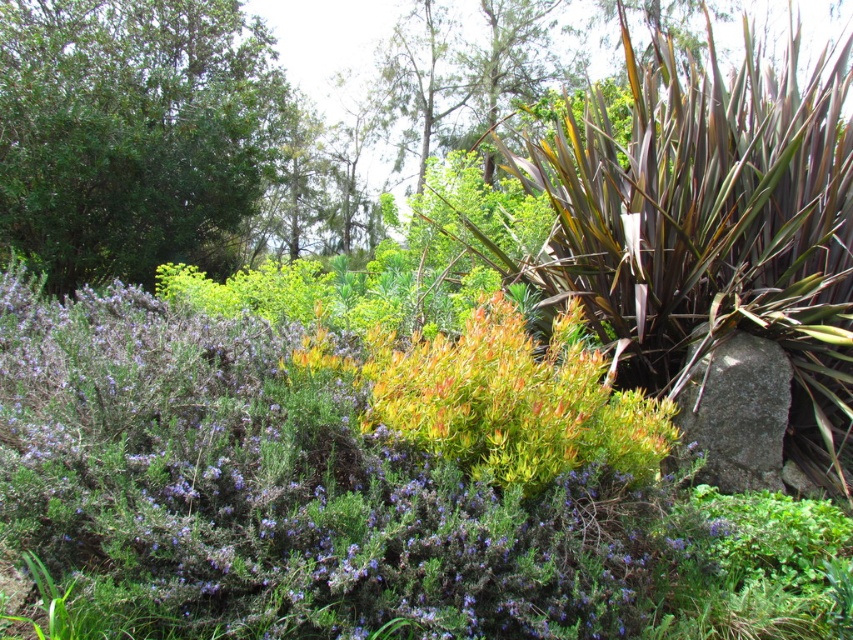
Question: Does green leafy tree at upper left have a greater width compared to gray rough stone at lower right?

Choices:
 (A) no
 (B) yes

Answer: (A)

Question: Which is farther from the gray rough stone at lower right?

Choices:
 (A) purple leafy bush at center
 (B) green leafy tree at upper left

Answer: (B)

Question: Based on their relative distances, which object is farther from the gray rough stone at lower right?

Choices:
 (A) purple leafy bush at center
 (B) green leafy tree at upper left

Answer: (B)

Question: Can you confirm if purple leafy bush at center is thinner than green leafy tree at upper left?

Choices:
 (A) no
 (B) yes

Answer: (A)

Question: Can you confirm if purple leafy bush at center is positioned above green leafy tree at upper left?

Choices:
 (A) yes
 (B) no

Answer: (B)

Question: Which is farther from the gray rough stone at lower right?

Choices:
 (A) green leafy tree at upper left
 (B) purple leafy bush at center

Answer: (A)